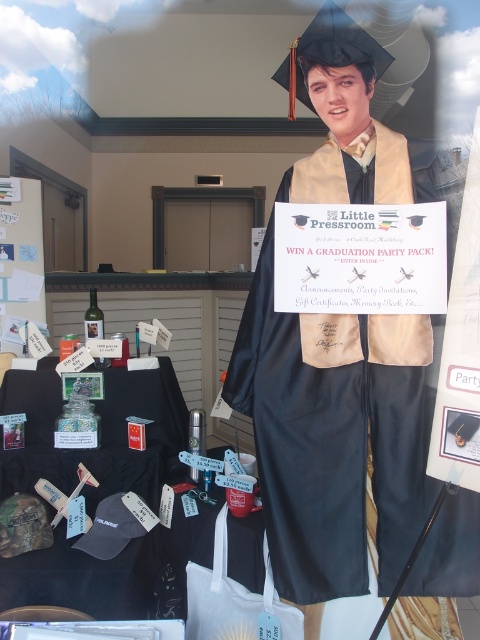
You are a customer standing in front of the store window. You see the gold satin graduation gown at center and the black fabric table at lower left. Which object is nearer to you?

The gold satin graduation gown at center is closer to the viewer than the black fabric table at lower left.

Looking at this image, you are a customer standing in front of the store window. You see the gold satin graduation gown at center and the black fabric table at lower left. Which object is larger?

The black fabric table at lower left is larger than the gold satin graduation gown at center.